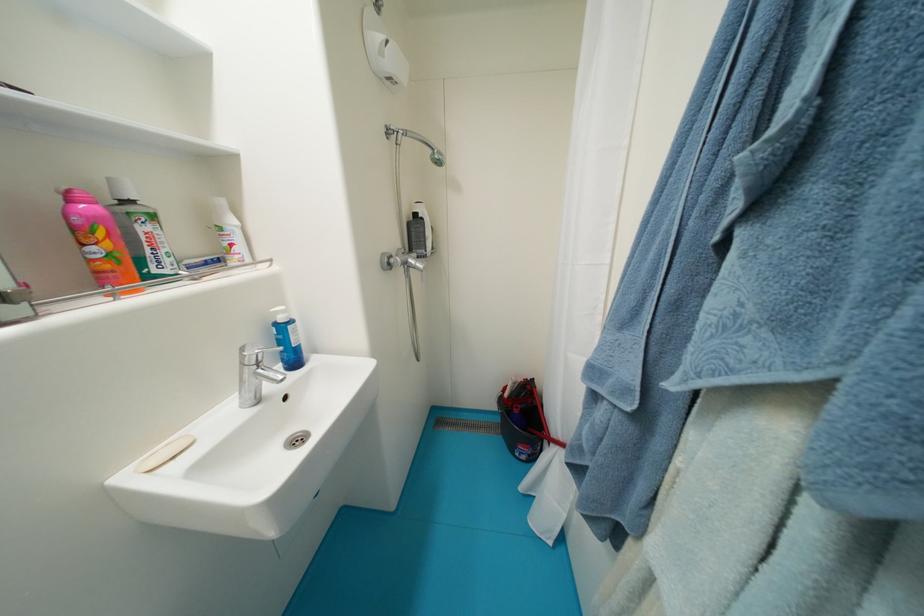
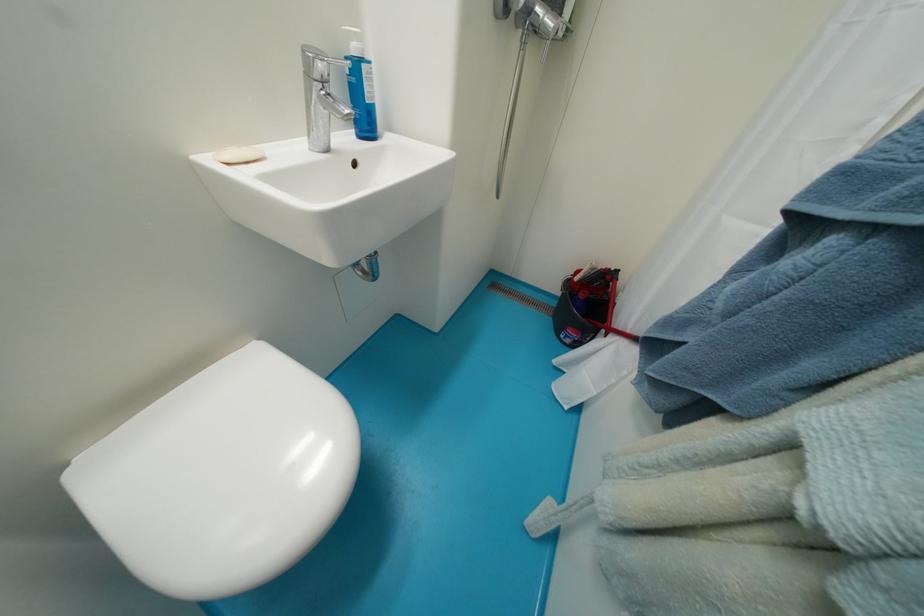
Locate, in the second image, the point that corresponds to point (297, 330) in the first image.

(371, 70)